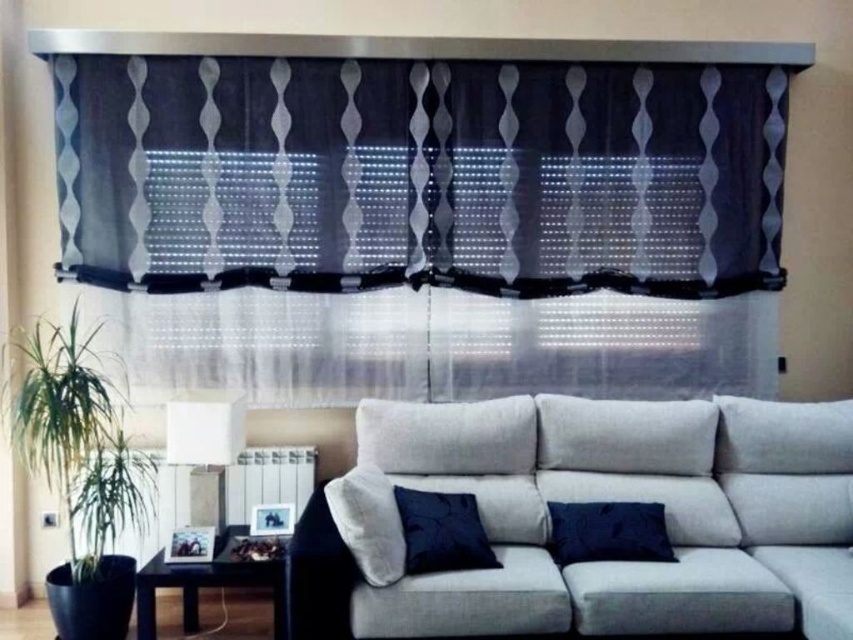
You are standing in the living room and want to determine the relative positions of two points in the scene. Specifically, you need to know which point is closer to you. The points are labeled as point 1 at coordinates point (128,515) and point 2 at coordinates point (647,541). Based on the scene description, which point is closer to your position?

Point 1 at coordinates point (128,515) is closer to you because it is further to the camera than point 2 at coordinates point (647,541).

You are planning to hang a new painting that is 1.2 meters tall. You want to place it between the textured gray curtain at upper center and the dark blue velvet pillow at lower center. Considering their heights, will the painting fit vertically between them?

The textured gray curtain at upper center is much taller than the dark blue velvet pillow at lower center. Since the painting is 1.2 meters tall, it should fit vertically between them as there is sufficient vertical space between the two objects.

You are standing in the living room and want to move from point A to point B. Point A is located at coordinate point A which is point (648, 465) and point B is at point (77, 544). According to the scene description, which point is closer to you when you are facing the sofa?

Point (648, 465) is in front of point (77, 544), so when facing the sofa, point A is closer to you than point B.